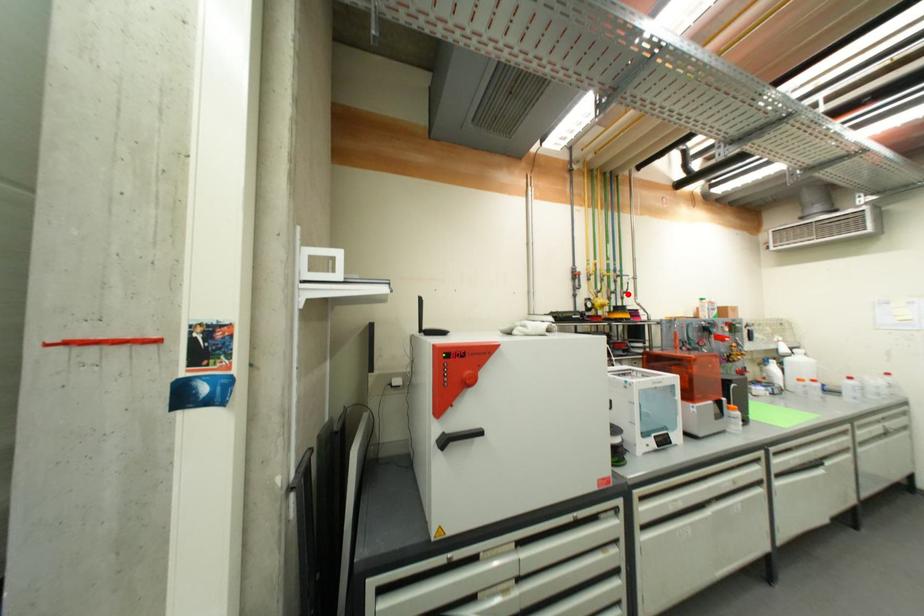
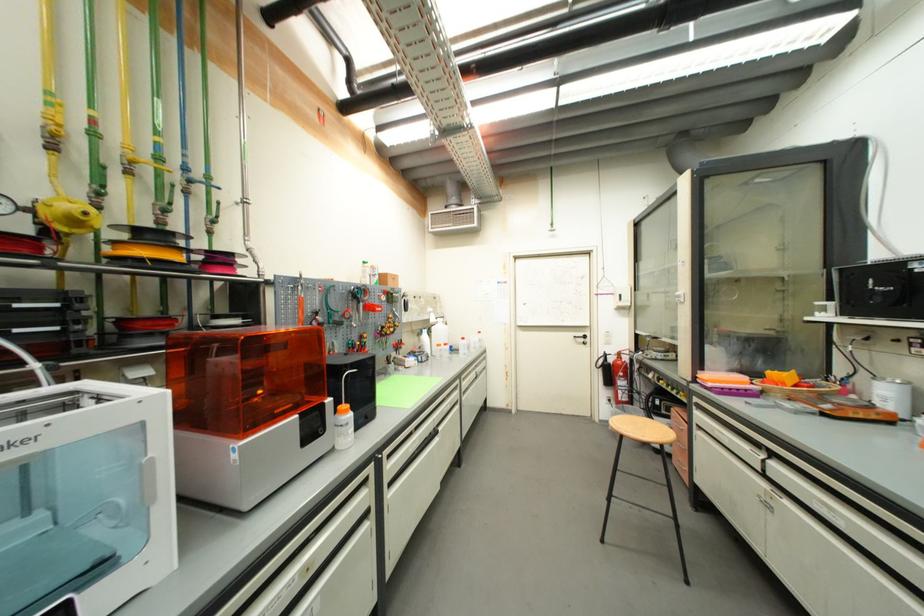
In the second image, find the point that corresponds to the highlighted location in the first image.

(213, 222)